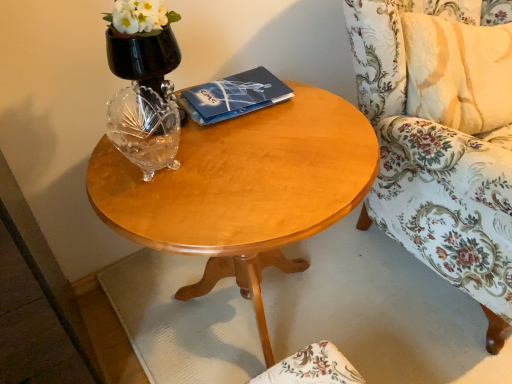
The width and height of the screenshot is (512, 384). Describe the element at coordinates (234, 96) in the screenshot. I see `dark blue matte paper at center` at that location.

The image size is (512, 384). I want to click on light wood/finish coffee table at center, so click(244, 190).

Which is in front, point (405, 221) or point (265, 71)?

Point (265, 71)

Are floral fabric chair at right and dark blue matte paper at center beside each other?

floral fabric chair at right is not next to dark blue matte paper at center, and they're not touching.

From a real-world perspective, which is physically above, floral fabric chair at right or dark blue matte paper at center?

From a 3D spatial view, dark blue matte paper at center is above.

What's the angular difference between floral fabric chair at right and dark blue matte paper at center's facing directions?

The angular difference between floral fabric chair at right and dark blue matte paper at center is 4.6 degrees.

Is black glass vase at upper left directly adjacent to floral fabric chair at right?

No.

From a real-world perspective, is black glass vase at upper left positioned under floral fabric chair at right based on gravity?

No.

I want to click on vase behind the floral fabric chair at right, so click(x=143, y=57).

Which of these two, floral fabric chair at right or black glass vase at upper left, is thinner?

black glass vase at upper left.

From the image's perspective, between floral fabric chair at right and black glass vase at upper left, which one is located above?

black glass vase at upper left, from the image's perspective.

Considering the positions of objects floral fabric chair at right and black glass vase at upper left in the image provided, who is more to the right, floral fabric chair at right or black glass vase at upper left?

Positioned to the right is floral fabric chair at right.

From a real-world perspective, relative to black glass vase at upper left, is floral fabric chair at right vertically above or below?

floral fabric chair at right is situated lower than black glass vase at upper left in the real world.

In terms of height, does light wood/finish coffee table at center look taller or shorter compared to black glass vase at upper left?

Considering their sizes, light wood/finish coffee table at center has more height than black glass vase at upper left.

From the image's perspective, which one is positioned lower, light wood/finish coffee table at center or black glass vase at upper left?

light wood/finish coffee table at center is shown below in the image.

In the image, is light wood/finish coffee table at center on the left side or the right side of black glass vase at upper left?

Clearly, light wood/finish coffee table at center is on the right of black glass vase at upper left in the image.

Visually, is light wood/finish coffee table at center positioned to the left or to the right of floral fabric chair at right?

Based on their positions, light wood/finish coffee table at center is located to the left of floral fabric chair at right.

Can you confirm if light wood/finish coffee table at center is shorter than floral fabric chair at right?

Yes, light wood/finish coffee table at center is shorter than floral fabric chair at right.

What are the coordinates of `coffee table below the floral fabric chair at right (from the image's perspective)` in the screenshot? It's located at (x=244, y=190).

Is light wood/finish coffee table at center positioned with its back to floral fabric chair at right?

No.

Is point (127, 42) positioned in front of point (146, 209)?

No, it is behind (146, 209).

From the picture: Which is behind, black glass vase at upper left or light wood/finish coffee table at center?

black glass vase at upper left is behind.

Is black glass vase at upper left looking in the opposite direction of light wood/finish coffee table at center?

black glass vase at upper left does not have its back to light wood/finish coffee table at center.

Considering the relative sizes of light wood/finish coffee table at center and dark blue matte paper at center in the image provided, is light wood/finish coffee table at center wider than dark blue matte paper at center?

Correct, the width of light wood/finish coffee table at center exceeds that of dark blue matte paper at center.

Find the location of a particular element. This screenshot has height=384, width=512. coffee table located on the right of dark blue matte paper at center is located at coordinates (244, 190).

From a real-world perspective, who is located lower, light wood/finish coffee table at center or dark blue matte paper at center?

Result: In real-world perspective, light wood/finish coffee table at center is lower.

Is light wood/finish coffee table at center positioned with its back to dark blue matte paper at center?

light wood/finish coffee table at center does not have its back to dark blue matte paper at center.

This screenshot has width=512, height=384. I want to click on chair that appears in front of the dark blue matte paper at center, so click(x=435, y=167).

Locate an element on the screen. vase located above the floral fabric chair at right (from the image's perspective) is located at coordinates (143, 57).

Considering their positions, is dark blue matte paper at center positioned further to black glass vase at upper left than floral fabric chair at right?

The object further to black glass vase at upper left is floral fabric chair at right.

From the image, which object appears to be nearer to dark blue matte paper at center, light wood/finish coffee table at center or floral fabric chair at right?

The object closer to dark blue matte paper at center is light wood/finish coffee table at center.

Which object lies further to the anchor point floral fabric chair at right, dark blue matte paper at center or black glass vase at upper left?

Among the two, black glass vase at upper left is located further to floral fabric chair at right.

When comparing their distances from black glass vase at upper left, does light wood/finish coffee table at center or dark blue matte paper at center seem further?

light wood/finish coffee table at center.

Which object lies further to the anchor point dark blue matte paper at center, floral fabric chair at right or light wood/finish coffee table at center?

floral fabric chair at right lies further to dark blue matte paper at center than the other object.

Looking at the image, which one is located further to light wood/finish coffee table at center, black glass vase at upper left or floral fabric chair at right?

floral fabric chair at right lies further to light wood/finish coffee table at center than the other object.

When comparing their distances from dark blue matte paper at center, does light wood/finish coffee table at center or black glass vase at upper left seem further?

Among the two, black glass vase at upper left is located further to dark blue matte paper at center.

From the image, which object appears to be nearer to light wood/finish coffee table at center, dark blue matte paper at center or floral fabric chair at right?

dark blue matte paper at center.

Find the location of a particular element. This screenshot has width=512, height=384. paperback book that lies between black glass vase at upper left and light wood/finish coffee table at center from top to bottom is located at coordinates (234, 96).

At what (x,y) coordinates should I click in order to perform the action: click on paperback book between black glass vase at upper left and floral fabric chair at right from left to right. Please return your answer as a coordinate pair (x, y). This screenshot has width=512, height=384. Looking at the image, I should click on (234, 96).

Locate an element on the screen. Image resolution: width=512 pixels, height=384 pixels. coffee table located between dark blue matte paper at center and floral fabric chair at right in the left-right direction is located at coordinates (244, 190).

The image size is (512, 384). Identify the location of coffee table situated between black glass vase at upper left and floral fabric chair at right from left to right. (244, 190).